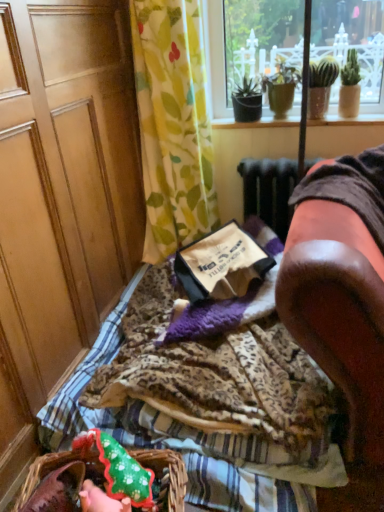
Question: Does brown paper bag at center have a lesser height compared to leopard print fabric at center?

Choices:
 (A) yes
 (B) no

Answer: (B)

Question: Is brown paper bag at center facing away from leopard print fabric at center?

Choices:
 (A) no
 (B) yes

Answer: (A)

Question: From a real-world perspective, is brown paper bag at center positioned under leopard print fabric at center based on gravity?

Choices:
 (A) no
 (B) yes

Answer: (A)

Question: Is brown paper bag at center to the right of leopard print fabric at center from the viewer's perspective?

Choices:
 (A) no
 (B) yes

Answer: (B)

Question: Is brown paper bag at center oriented towards leopard print fabric at center?

Choices:
 (A) no
 (B) yes

Answer: (A)

Question: Considering the relative sizes of brown paper bag at center and leopard print fabric at center in the image provided, is brown paper bag at center smaller than leopard print fabric at center?

Choices:
 (A) no
 (B) yes

Answer: (B)

Question: Is leopard print fabric at center bigger than brown paper bag at center?

Choices:
 (A) no
 (B) yes

Answer: (B)

Question: From a real-world perspective, is leopard print fabric at center physically below brown paper bag at center?

Choices:
 (A) yes
 (B) no

Answer: (A)

Question: From the image's perspective, is leopard print fabric at center on top of brown paper bag at center?

Choices:
 (A) no
 (B) yes

Answer: (A)

Question: Can you confirm if leopard print fabric at center is shorter than brown paper bag at center?

Choices:
 (A) no
 (B) yes

Answer: (B)

Question: Is leopard print fabric at center to the left of brown paper bag at center from the viewer's perspective?

Choices:
 (A) no
 (B) yes

Answer: (B)

Question: Does leopard print fabric at center contain brown paper bag at center?

Choices:
 (A) yes
 (B) no

Answer: (B)

Question: Would you say brown leather armchair at right is a long distance from leopard print fabric at center?

Choices:
 (A) yes
 (B) no

Answer: (B)